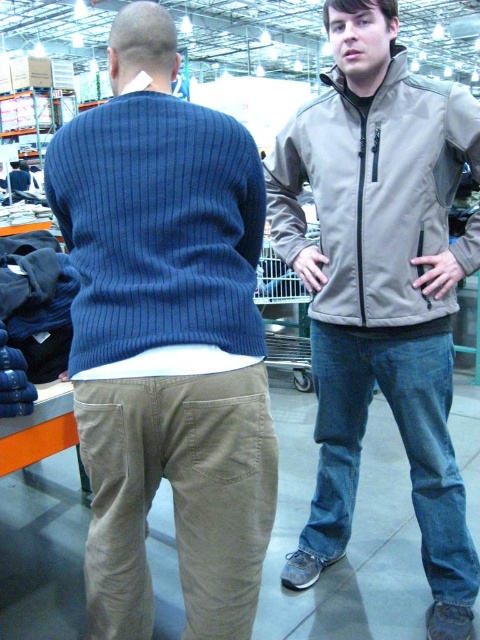
Question: Is khaki cotton pants at back below metallic silver shopping cart at center?

Choices:
 (A) yes
 (B) no

Answer: (A)

Question: Which object appears farthest from the camera in this image?

Choices:
 (A) khaki cotton pants at back
 (B) ribbed blue sweater at back

Answer: (A)

Question: Does khaki cotton pants at back have a lesser width compared to tan softshell jacket at upper right?

Choices:
 (A) yes
 (B) no

Answer: (A)

Question: Which point appears closest to the camera in this image?

Choices:
 (A) (118, 541)
 (B) (297, 278)

Answer: (A)

Question: Which object is farther from the camera taking this photo?

Choices:
 (A) khaki cotton pants at back
 (B) ribbed blue sweater at back
 (C) ribbed knit sweater at back

Answer: (C)

Question: Can you confirm if ribbed knit sweater at back is thinner than khaki cotton pants at back?

Choices:
 (A) yes
 (B) no

Answer: (B)